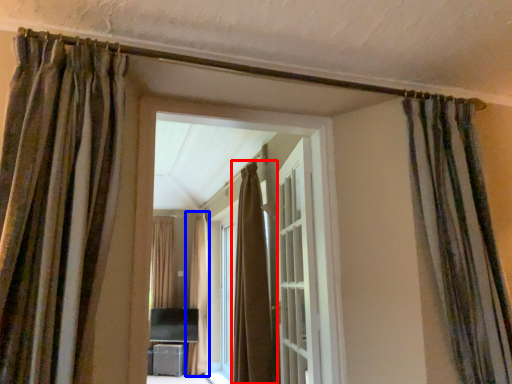
Question: Which object is further to the camera taking this photo, curtain (highlighted by a red box) or curtain (highlighted by a blue box)?

Choices:
 (A) curtain
 (B) curtain

Answer: (B)